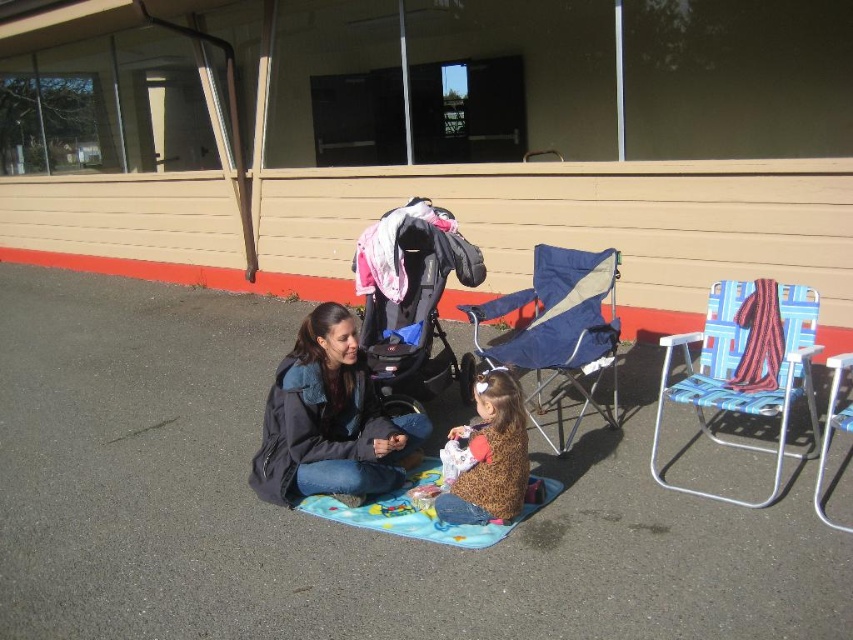
Does point (727, 401) come in front of point (734, 380)?

Yes.

This screenshot has width=853, height=640. Find the location of `blue woven chair at right`. blue woven chair at right is located at coordinates (746, 365).

The height and width of the screenshot is (640, 853). I want to click on blue woven chair at right, so click(x=746, y=365).

Which is in front, point (347, 323) or point (413, 515)?

Point (413, 515) is in front.

Is point (347, 490) closer to viewer compared to point (540, 497)?

Yes, it is.

Find the location of a particular element. The image size is (853, 640). matte black jacket at center is located at coordinates (329, 420).

Who is taller, multicolored fabric mat at center or striped fabric blanket at right?

Standing taller between the two is striped fabric blanket at right.

Measure the distance between multicolored fabric mat at center and striped fabric blanket at right.

multicolored fabric mat at center and striped fabric blanket at right are 1.38 meters apart.

Does point (393, 516) come closer to viewer compared to point (764, 358)?

Yes, it is in front of point (764, 358).

Find the location of a particular element. The height and width of the screenshot is (640, 853). multicolored fabric mat at center is located at coordinates (426, 512).